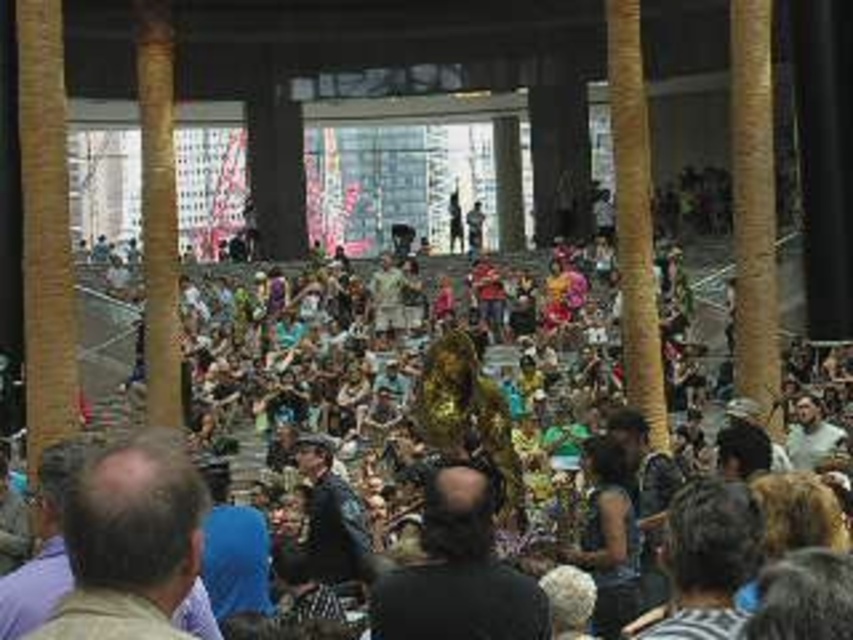
You are a GUI agent. You are given a task and a screenshot of the screen. Output one action in this format:
    pyautogui.click(x=<x>, y=<y>)
    Task: Click on the multicolored fabric crowd at center
    
    Given the screenshot: What is the action you would take?
    pyautogui.click(x=515, y=506)

Can you confirm if multicolored fabric crowd at center is bigger than brown hair at lower left?

Correct, multicolored fabric crowd at center is larger in size than brown hair at lower left.

Is point (227, 566) farther from camera compared to point (96, 538)?

That is True.

At what (x,y) coordinates should I click in order to perform the action: click on multicolored fabric crowd at center. Please return your answer as a coordinate pair (x, y). Looking at the image, I should click on (515, 506).